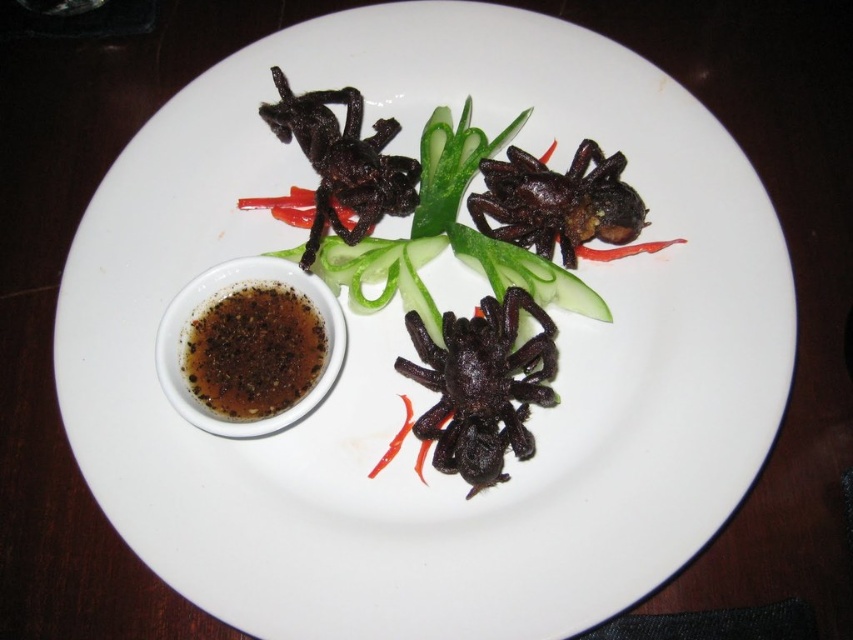
Does brown glossy sauce at lower left appear on the left side of black matte spider at upper left?

Correct, you'll find brown glossy sauce at lower left to the left of black matte spider at upper left.

Is point (218, 305) less distant than point (264, 109)?

Yes, it is in front of point (264, 109).

Between point (227, 376) and point (389, 125), which one is positioned behind?

Positioned behind is point (389, 125).

Identify the location of brown glossy sauce at lower left. The height and width of the screenshot is (640, 853). (254, 352).

Is black crispy spider at center wider than shiny black spider at upper center?

Yes.

Between black crispy spider at center and shiny black spider at upper center, which one is positioned lower?

Positioned lower is black crispy spider at center.

Does point (604, 216) lie behind point (585, 173)?

No, (604, 216) is in front of (585, 173).

Identify the location of black crispy spider at center. The height and width of the screenshot is (640, 853). [x=461, y=257].

Where is `black crispy spider at center`? The width and height of the screenshot is (853, 640). black crispy spider at center is located at coordinates (461, 257).

Who is positioned more to the right, black crispy spider at center or brown glossy sauce at lower left?

black crispy spider at center is more to the right.

This screenshot has height=640, width=853. Identify the location of black crispy spider at center. (461, 257).